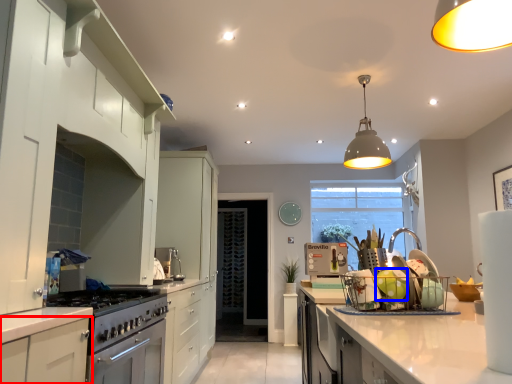
Question: Among these objects, which one is farthest to the camera, cabinetry (highlighted by a red box) or food (highlighted by a blue box)?

Choices:
 (A) cabinetry
 (B) food

Answer: (B)